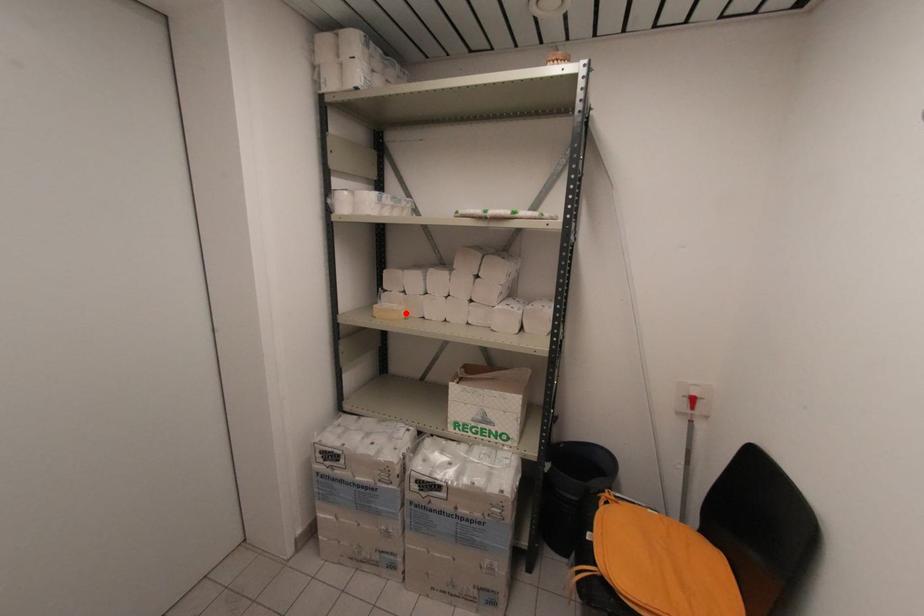
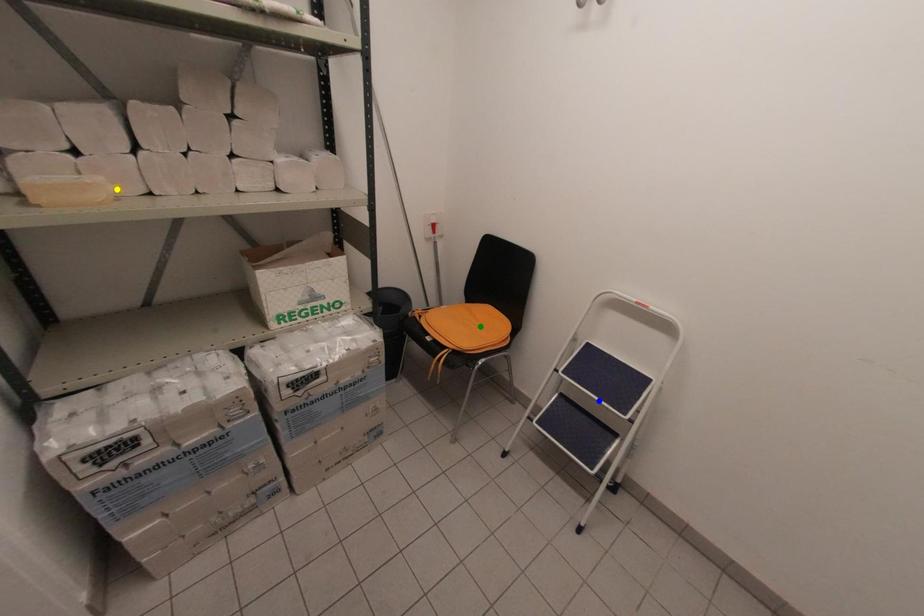
Question: I am providing you with two images of the same scene from different viewpoints. A red point is marked on the first image. You are given multiple points on the second image. Which point in image 2 represents the same 3d spot as the red point in image 1?

Choices:
 (A) blue point
 (B) yellow point
 (C) green point

Answer: (B)